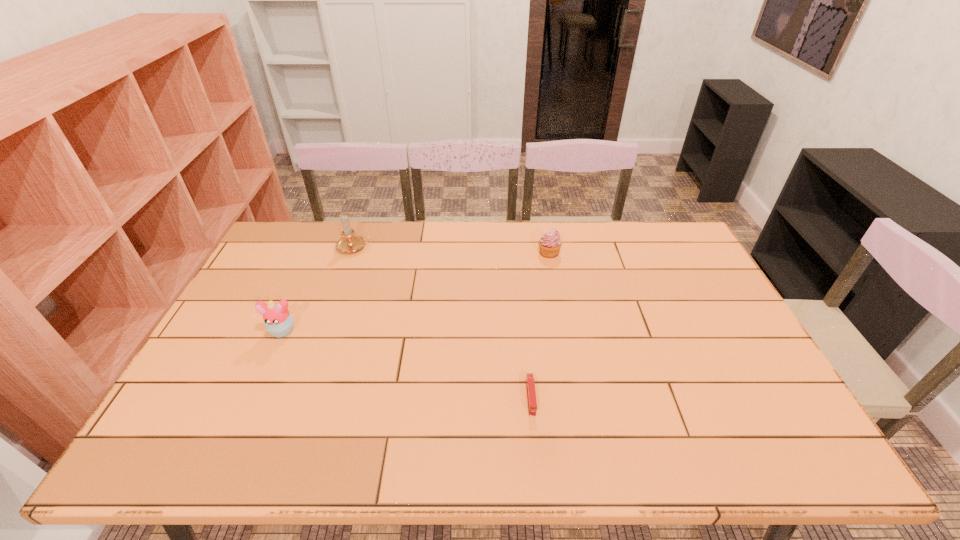
Image resolution: width=960 pixels, height=540 pixels. In order to click on vacant area that lies between the second shortest object and the candle in this screenshot , I will do `click(452, 250)`.

The image size is (960, 540). I want to click on free space that is in between the second object from left to right and the rightmost object, so click(x=452, y=250).

Find the location of a particular element. This screenshot has height=540, width=960. vacant area that lies between the leftmost object and the candle is located at coordinates (319, 289).

Find the location of a particular element. vacant space that's between the right cupcake and the leftmost object is located at coordinates (416, 292).

Image resolution: width=960 pixels, height=540 pixels. I want to click on vacant point located between the farther cupcake and the candle, so click(x=452, y=250).

Locate an element on the screen. vacant area that lies between the rightmost object and the third object from right to left is located at coordinates (452, 250).

This screenshot has height=540, width=960. What are the coordinates of `vacant space in between the left cupcake and the candle` in the screenshot? It's located at (319, 289).

At what (x,y) coordinates should I click in order to perform the action: click on free spot between the candle and the left cupcake. Please return your answer as a coordinate pair (x, y). Looking at the image, I should click on tap(319, 289).

Where is `free space that is in between the nearest object and the right cupcake`? The height and width of the screenshot is (540, 960). free space that is in between the nearest object and the right cupcake is located at coordinates (540, 325).

Locate an element on the screen. object that stands as the third closest to the second nearest object is located at coordinates (550, 243).